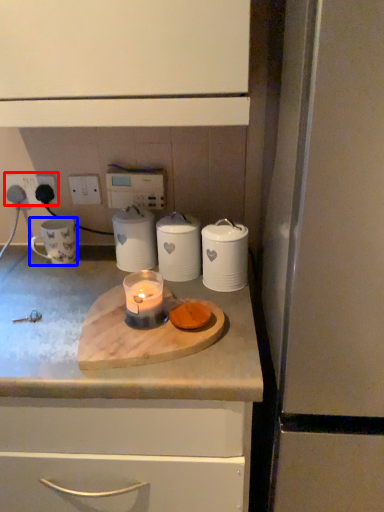
Question: Which point is closer to the camera, electric outlet (highlighted by a red box) or mug (highlighted by a blue box)?

Choices:
 (A) electric outlet
 (B) mug

Answer: (B)